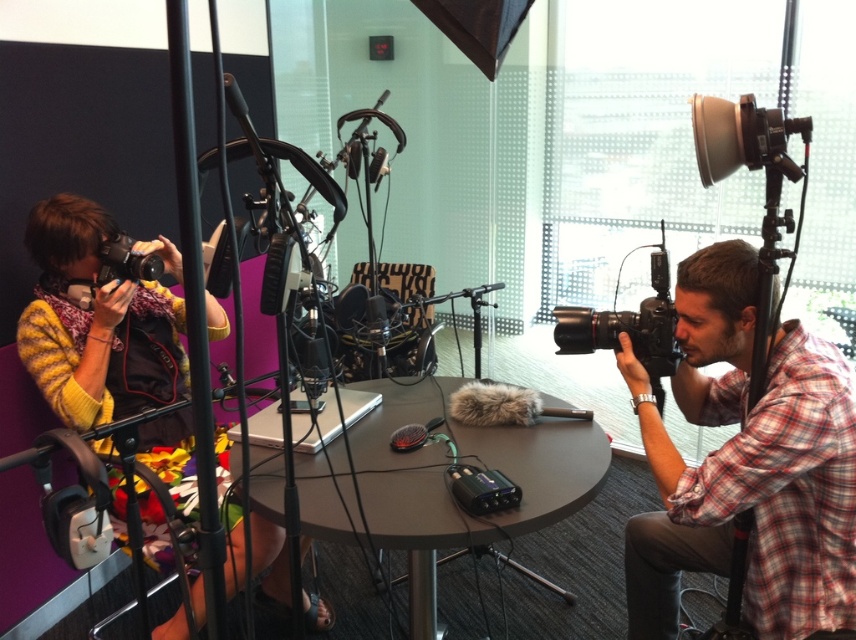
Question: Among these objects, which one is nearest to the camera?

Choices:
 (A) plaid shirt at right
 (B) black plastic camera at right

Answer: (A)

Question: Does yellow sweater at left have a lesser width compared to matte black camera at left?

Choices:
 (A) yes
 (B) no

Answer: (B)

Question: Can you confirm if plaid shirt at right is thinner than matte black camera at left?

Choices:
 (A) yes
 (B) no

Answer: (B)

Question: Can you confirm if yellow sweater at left is wider than matte black camera at left?

Choices:
 (A) no
 (B) yes

Answer: (B)

Question: Which object is positioned farthest from the yellow sweater at left?

Choices:
 (A) matte gray table at center
 (B) matte black camera at left
 (C) plaid shirt at right
 (D) black plastic camera at right

Answer: (C)

Question: Which point is farther to the camera?

Choices:
 (A) matte black camera at left
 (B) black plastic camera at right
 (C) yellow sweater at left
 (D) plaid shirt at right

Answer: (A)